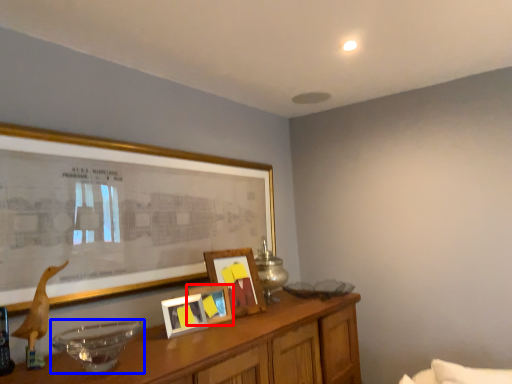
Question: Which of the following is the farthest to the observer, picture frame (highlighted by a red box) or glass bowl (highlighted by a blue box)?

Choices:
 (A) picture frame
 (B) glass bowl

Answer: (A)